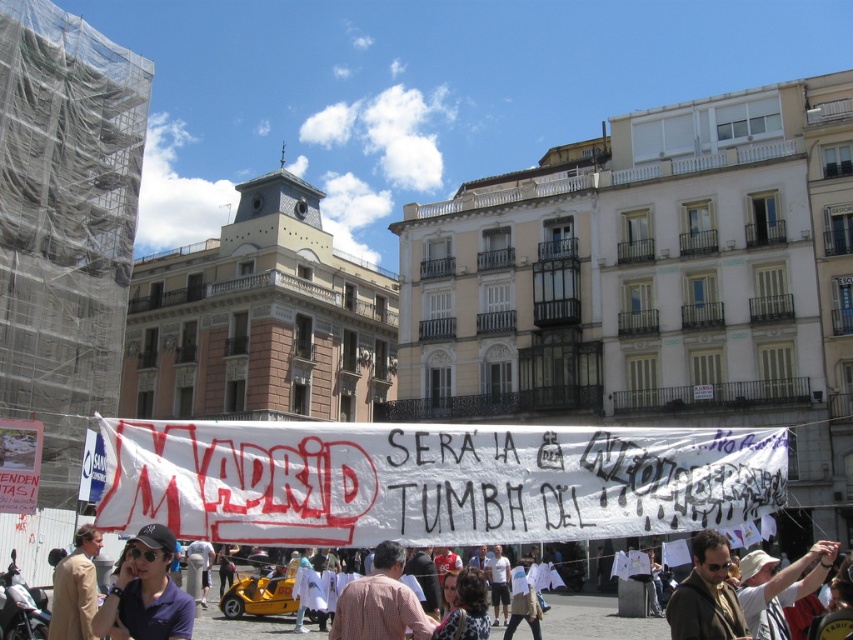
You are standing in the public square looking at the banner with the text. There are two points marked on the banner. Which point is closer to you, the point at coordinate [399,609] or the point at [91,563]?

The point at coordinate [399,609] is closer to you than the point at [91,563].

You are a photographer standing in the square and want to capture both the dark blue fabric cap at lower left and the plaid shirt at center in the same frame. Based on their positions, which object should you focus on first to ensure both are in focus?

The dark blue fabric cap at lower left is above the plaid shirt at center, so you should focus on the dark blue fabric cap at lower left first to ensure both are in focus.

You are a tourist in Madrid and see the banner with the bold red text. You also notice two items at the lower left corner of the image. Which item is positioned more to the right between the dark blue fabric cap at lower left and the beige wool coat at lower left?

The dark blue fabric cap at lower left is positioned more to the right than the beige wool coat at lower left.